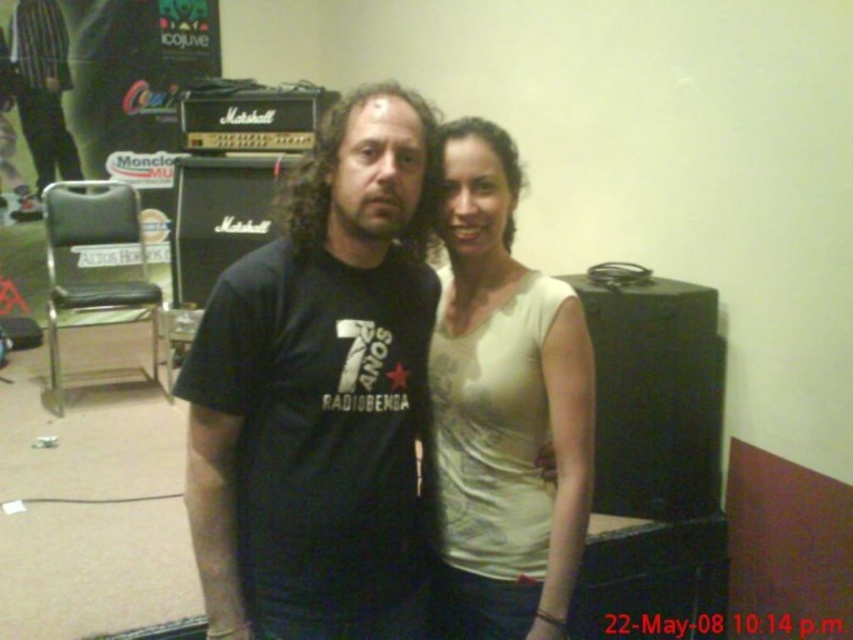
You are a photographer standing at the point marked as point (329, 566). You want to take a photo of both individuals so that they are in the frame without any part of them being cut off. Given that your camera has a maximum angle of view of 60 degrees, can you capture both individuals in a single frame?

The two individuals are 3.95 feet apart. Since the photographer is at point (329, 566), they can position themselves to ensure both are within the 60 degree angle of view, so yes, it is possible to capture both in a single frame.